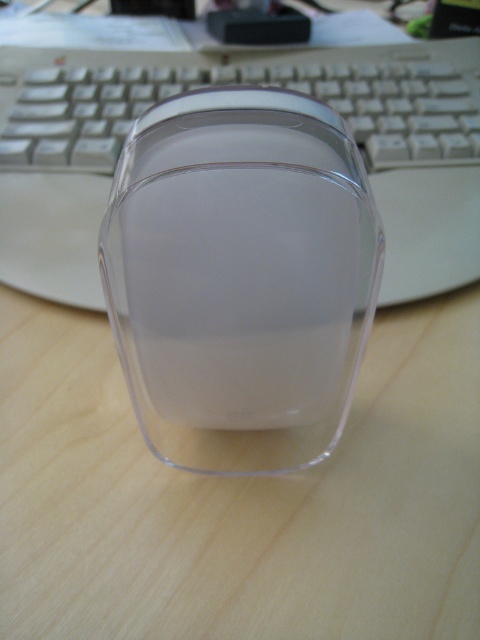
Question: Is transparent plastic mouse at center closer to camera compared to white plastic keyboard at center?

Choices:
 (A) yes
 (B) no

Answer: (A)

Question: Can you confirm if transparent plastic mouse at center is positioned to the left of white plastic keyboard at center?

Choices:
 (A) no
 (B) yes

Answer: (B)

Question: Which point appears closest to the camera in this image?

Choices:
 (A) (136, 150)
 (B) (119, 72)

Answer: (A)

Question: Is transparent plastic mouse at center wider than white plastic keyboard at center?

Choices:
 (A) no
 (B) yes

Answer: (A)